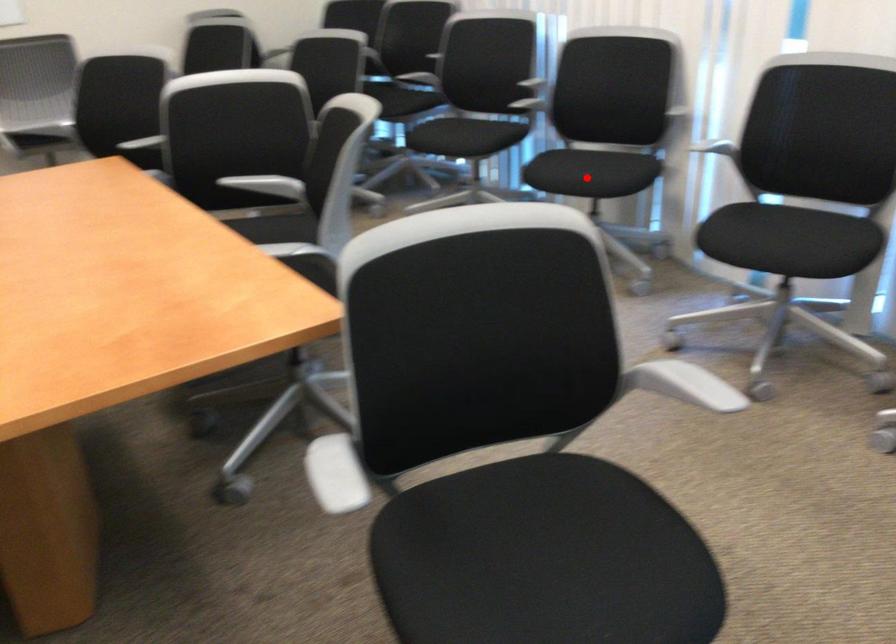
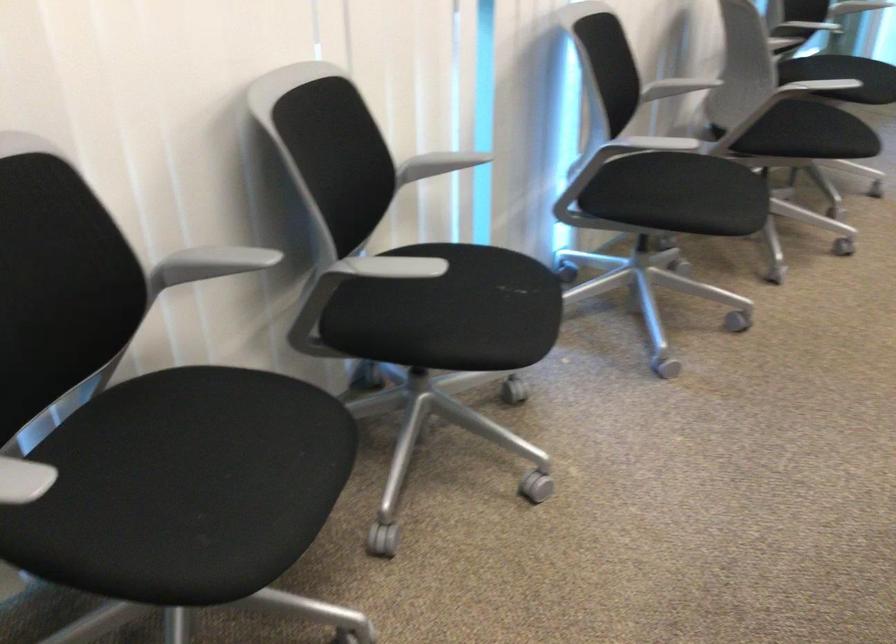
Question: I am providing you with two images of the same scene from different viewpoints. Given a red point in image1, look at the same physical point in image2. Is it:

Choices:
 (A) Closer to the viewpoint
 (B) Farther from the viewpoint

Answer: (A)